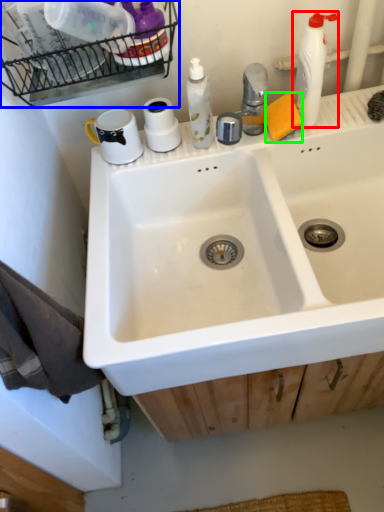
Question: Which object is positioned closest to cleaning product (highlighted by a red box)? Select from shelf (highlighted by a blue box) and soap (highlighted by a green box).

Choices:
 (A) shelf
 (B) soap

Answer: (B)